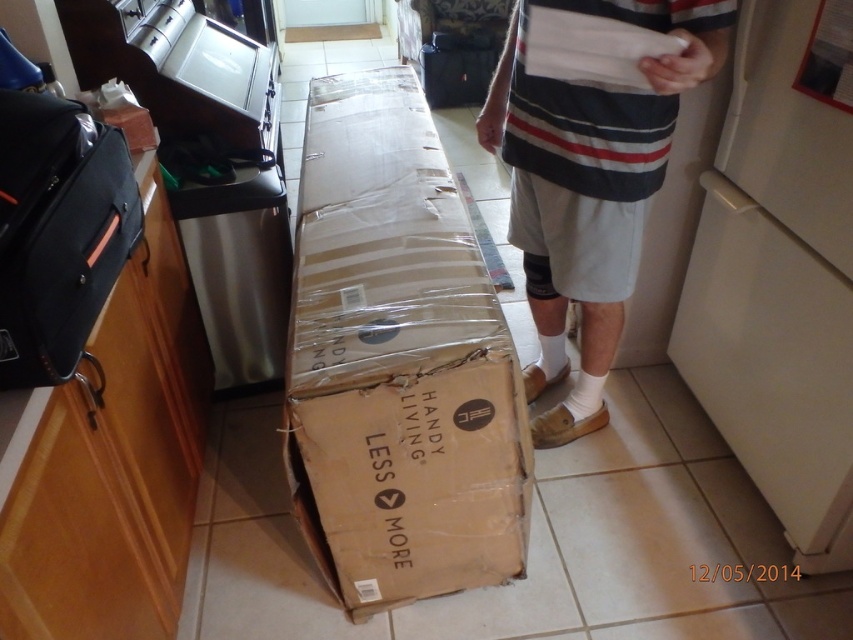
Question: Does brown cardboard box at center have a lesser width compared to white striped shorts at center?

Choices:
 (A) no
 (B) yes

Answer: (A)

Question: Which of the following is the closest to the observer?

Choices:
 (A) white striped shorts at center
 (B) brown cardboard box at center

Answer: (A)

Question: Which of the following is the farthest from the observer?

Choices:
 (A) (380, 273)
 (B) (561, 112)

Answer: (A)

Question: Is brown cardboard box at center to the right of white striped shorts at center from the viewer's perspective?

Choices:
 (A) yes
 (B) no

Answer: (B)

Question: Considering the relative positions of brown cardboard box at center and white striped shorts at center in the image provided, where is brown cardboard box at center located with respect to white striped shorts at center?

Choices:
 (A) above
 (B) below

Answer: (B)